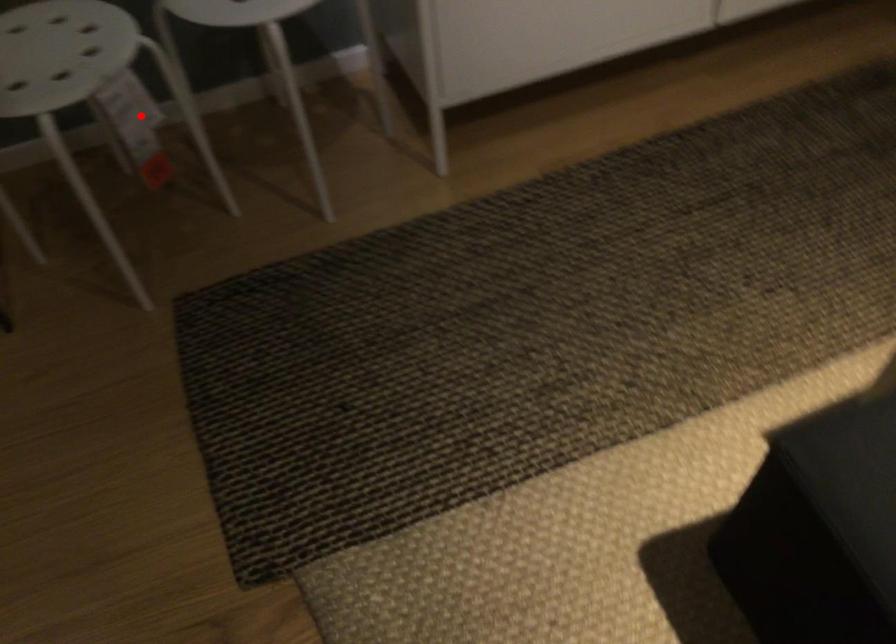
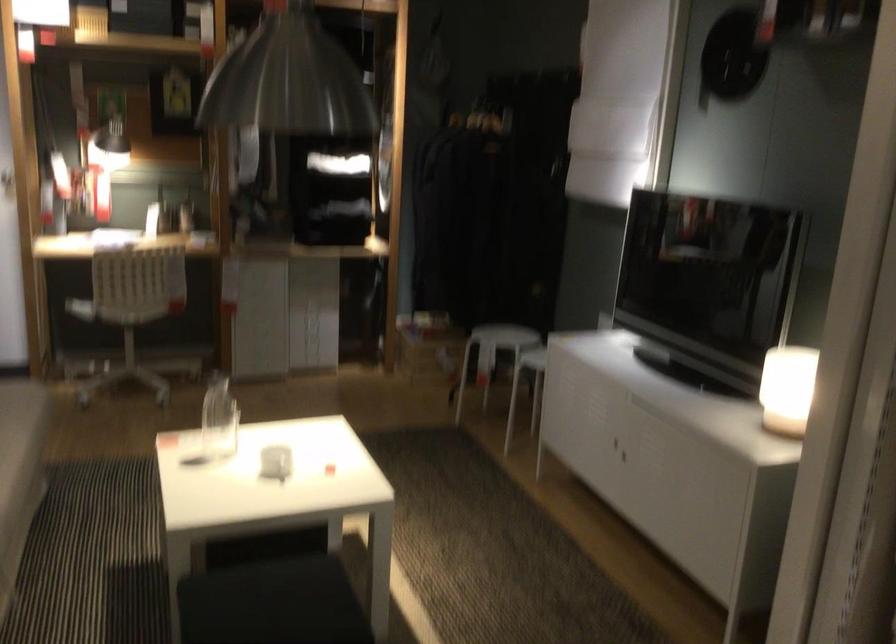
The point at the highlighted location is marked in the first image. Where is the corresponding point in the second image?

(492, 355)